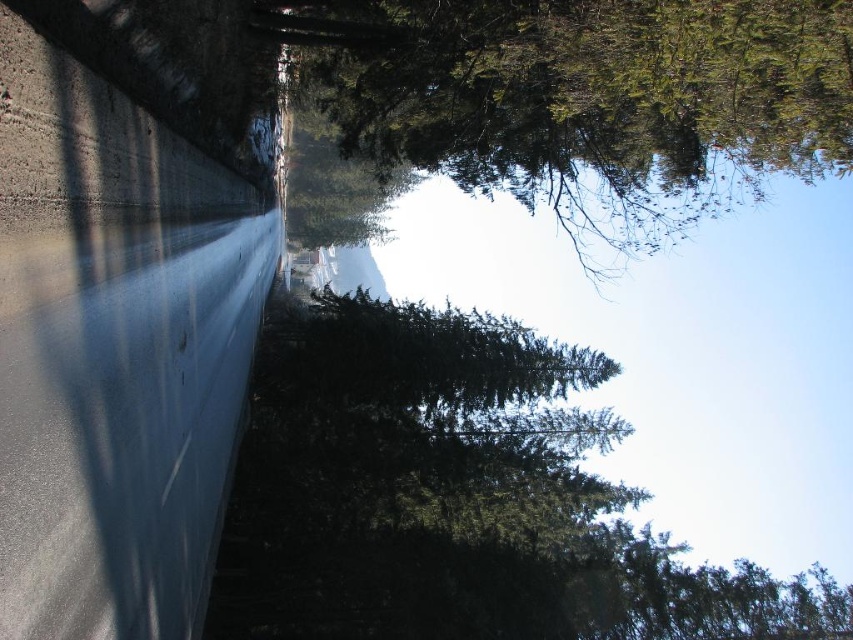
Question: Is green matte tree at center positioned behind green matte tree at upper center?

Choices:
 (A) no
 (B) yes

Answer: (B)

Question: Which point is farther from the camera taking this photo?

Choices:
 (A) (682, 1)
 (B) (598, 380)

Answer: (B)

Question: Is green matte tree at center thinner than green matte tree at upper center?

Choices:
 (A) yes
 (B) no

Answer: (B)

Question: Which object is closer to the camera taking this photo?

Choices:
 (A) green matte tree at center
 (B) green matte tree at upper center

Answer: (B)

Question: Does green matte tree at center lie behind green matte tree at upper center?

Choices:
 (A) yes
 (B) no

Answer: (A)

Question: Which point is closer to the camera taking this photo?

Choices:
 (A) (316, 328)
 (B) (569, 17)

Answer: (B)